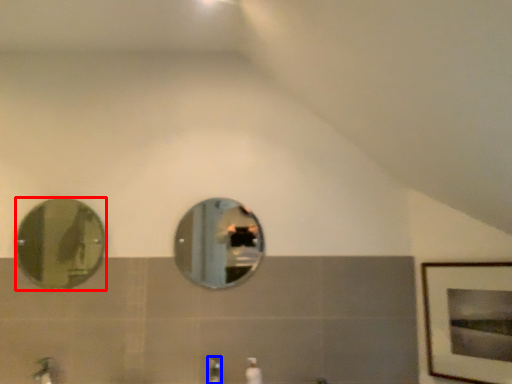
Question: Which object is closer to the camera taking this photo, mirror (highlighted by a red box) or faucet (highlighted by a blue box)?

Choices:
 (A) mirror
 (B) faucet

Answer: (B)